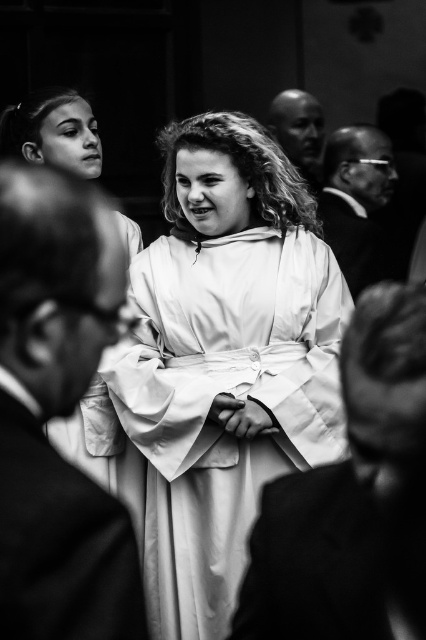
Who is lower down, smooth black suit at center or smooth bald head at upper center?

smooth black suit at center is below.

Does smooth black suit at center have a greater height compared to smooth bald head at upper center?

Correct, smooth black suit at center is much taller as smooth bald head at upper center.

Between point (54, 570) and point (313, 186), which one is positioned in front?

Positioned in front is point (54, 570).

Find the location of a particular element. Image resolution: width=426 pixels, height=640 pixels. smooth black suit at center is located at coordinates (58, 412).

Is white smooth robe at center closer to the viewer compared to smooth bald head at upper center?

Yes, white smooth robe at center is closer to the viewer.

How distant is white smooth robe at center from smooth bald head at upper center?

white smooth robe at center and smooth bald head at upper center are 5.53 meters apart from each other.

Between point (270, 404) and point (322, 112), which one is positioned behind?

Positioned behind is point (322, 112).

Identify the location of white smooth robe at center. Image resolution: width=426 pixels, height=640 pixels. (233, 397).

Can you confirm if white smooth robe at center is positioned to the left of smooth white robe at center?

Yes, white smooth robe at center is to the left of smooth white robe at center.

Who is more distant from viewer, (180, 308) or (380, 513)?

The point (180, 308) is more distant.

Locate an element on the screen. This screenshot has width=426, height=640. white smooth robe at center is located at coordinates (233, 397).